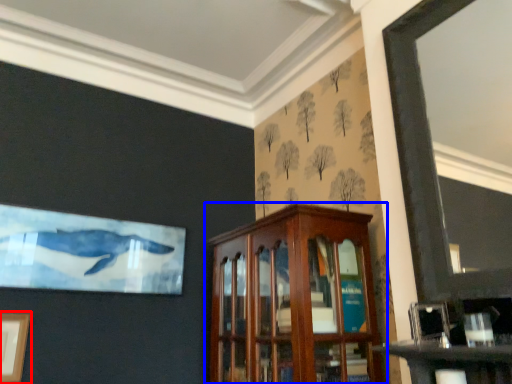
Question: Among these objects, which one is nearest to the camera, picture frame (highlighted by a red box) or cabinetry (highlighted by a blue box)?

Choices:
 (A) picture frame
 (B) cabinetry

Answer: (B)